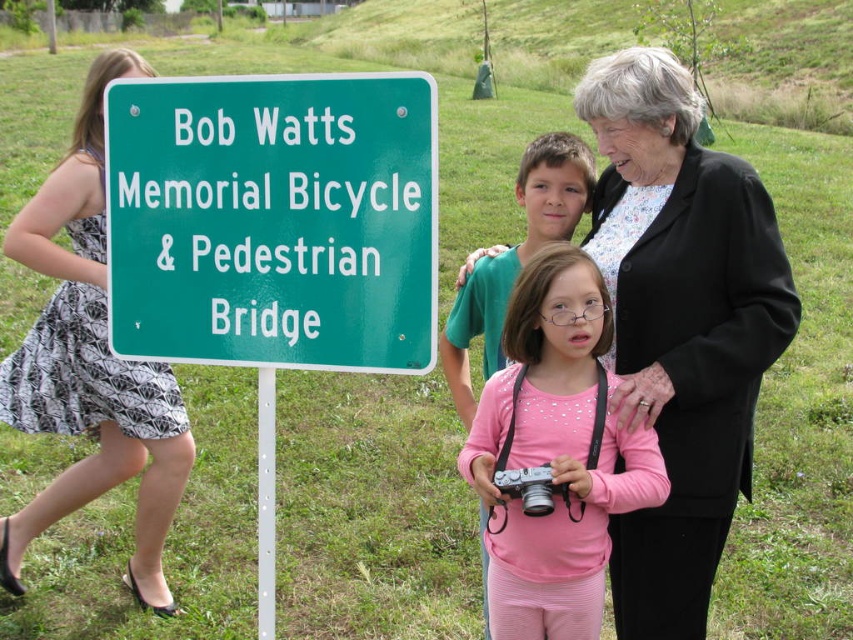
Is green metallic sign at left thinner than silver metallic camera at center?

No, green metallic sign at left is not thinner than silver metallic camera at center.

Is green metallic sign at left positioned behind silver metallic camera at center?

No, it is not.

Who is more forward, [283,280] or [537,500]?

Point [283,280] is more forward.

You are a GUI agent. You are given a task and a screenshot of the screen. Output one action in this format:
    pyautogui.click(x=<x>, y=<y>)
    Task: Click on the green metallic sign at left
    The width and height of the screenshot is (853, 640).
    Given the screenshot: What is the action you would take?
    pyautogui.click(x=273, y=220)

Who is shorter, green metallic sign at left or pink fabric shirt at center?

green metallic sign at left is shorter.

Which is behind, point (392, 364) or point (498, 605)?

Point (498, 605)

At what (x,y) coordinates should I click in order to perform the action: click on green metallic sign at left. Please return your answer as a coordinate pair (x, y). This screenshot has height=640, width=853. Looking at the image, I should click on (273, 220).

Is point (720, 189) positioned in front of point (496, 470)?

That is False.

Can you confirm if black textured blazer at upper right is shorter than silver metallic camera at center?

No, black textured blazer at upper right is not shorter than silver metallic camera at center.

What do you see at coordinates (680, 324) in the screenshot? I see `black textured blazer at upper right` at bounding box center [680, 324].

Locate an element on the screen. The height and width of the screenshot is (640, 853). black textured blazer at upper right is located at coordinates (680, 324).